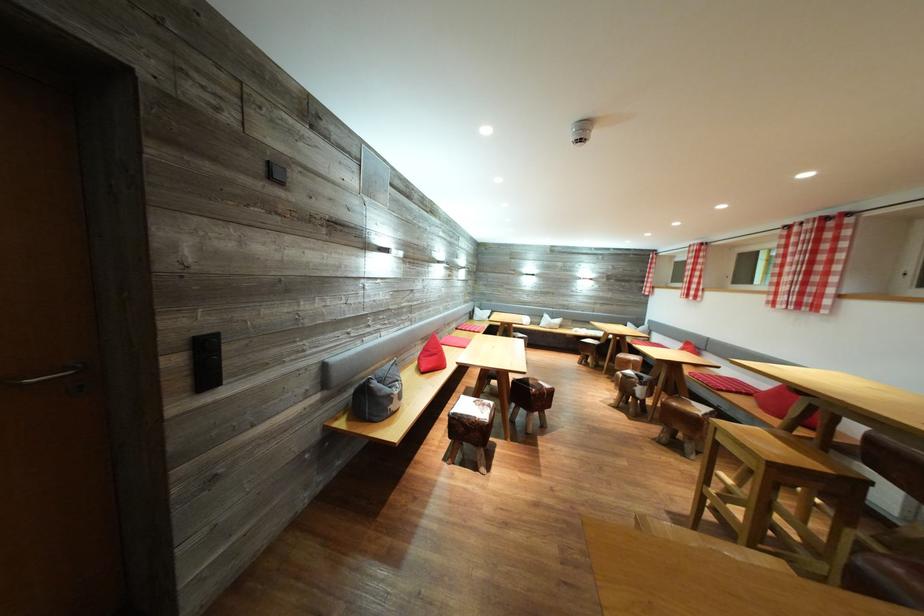
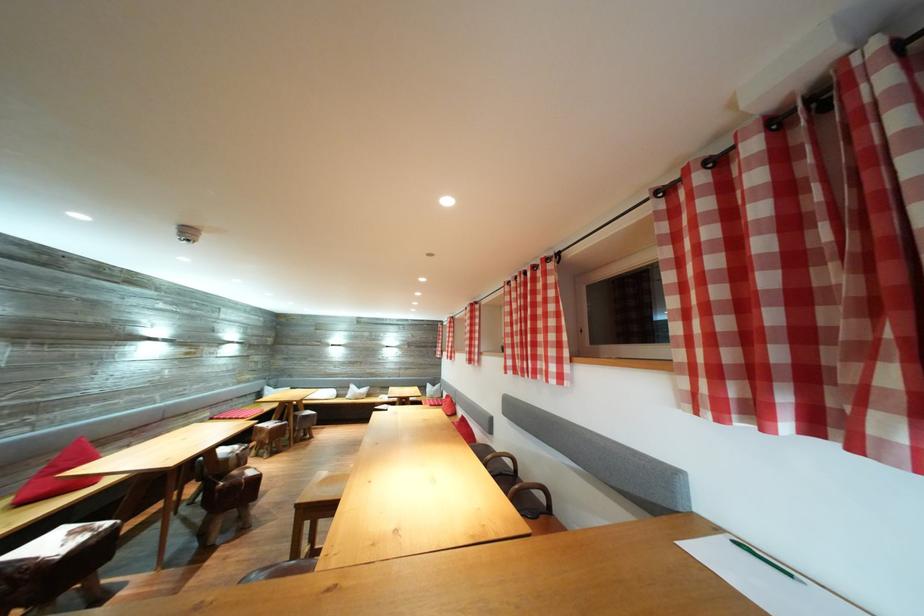
The point at (490, 410) is marked in the first image. Where is the corresponding point in the second image?

(91, 536)